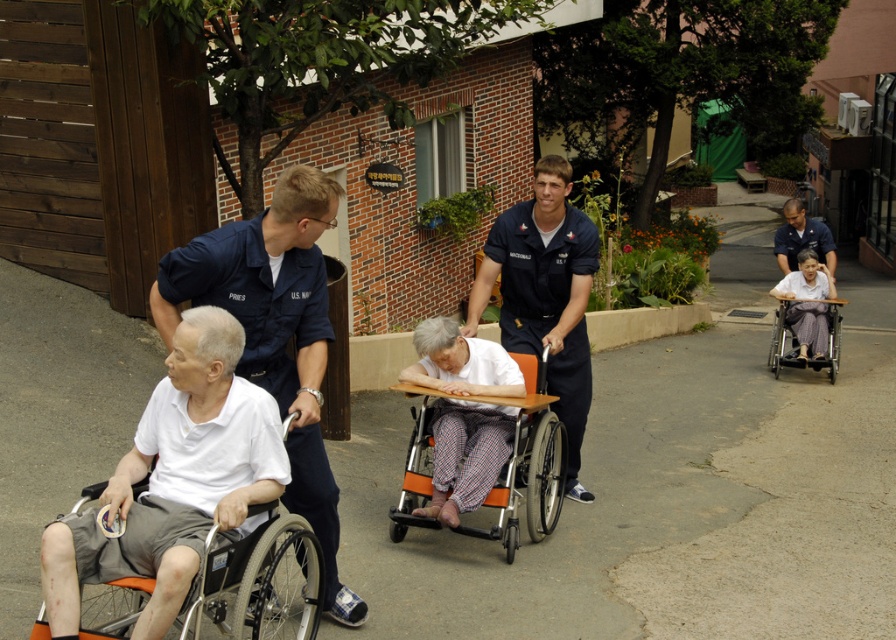
You are a caregiver trying to fit both the orange fabric wheelchair at left and the patterned fabric wheelchair at right through a doorway that is 1 meter wide. Based on their widths, can both wheelchairs pass through the doorway side by side?

The orange fabric wheelchair at left might be wider than the patterned fabric wheelchair at right. If the combined width of both wheelchairs exceeds 1 meter, they might not fit through the doorway side by side. However, without exact measurements, it is uncertain.